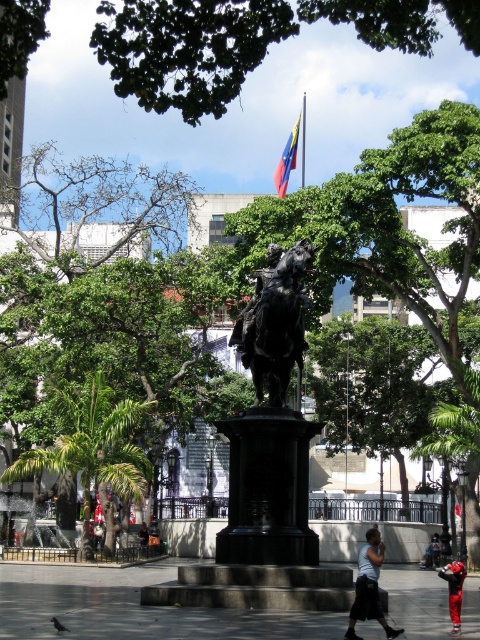
You are standing in the public square and want to take a photo of the bronze statue at center. To ensure the statue is in the center of your photo, where should you position your camera relative to the statue?

The bronze statue at center is located at coordinates point (x=275, y=321), so you should position your camera directly in front of the bronze statue at center to ensure it is centered in your photo.

You are standing in the public square and want to know how far the point at coordinates [289,204] is from you. Can you determine the distance?

The point at coordinates [289,204] is 93.34 meters away from you.